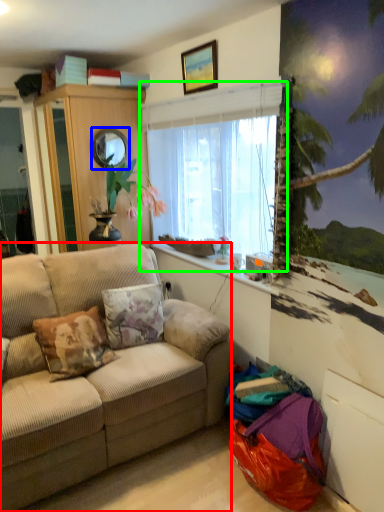
Question: Estimate the real-world distances between objects in this image. Which object is farther from studio couch (highlighted by a red box), mirror (highlighted by a blue box) or window (highlighted by a green box)?

Choices:
 (A) mirror
 (B) window

Answer: (A)